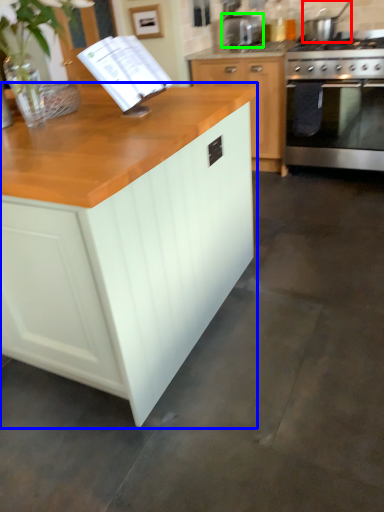
Question: Which object is positioned farthest from kitchen appliance (highlighted by a red box)? Select from cabinetry (highlighted by a blue box) and appliance (highlighted by a green box).

Choices:
 (A) cabinetry
 (B) appliance

Answer: (A)